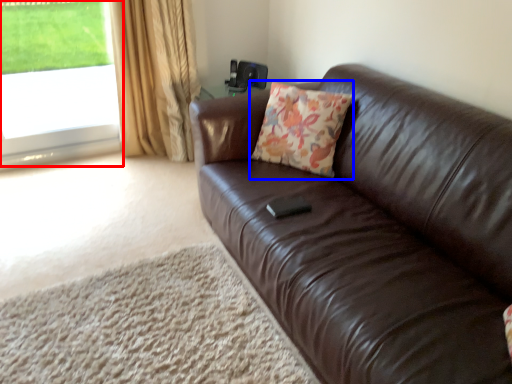
Question: Which point is closer to the camera, window (highlighted by a red box) or throw pillow (highlighted by a blue box)?

Choices:
 (A) window
 (B) throw pillow

Answer: (B)